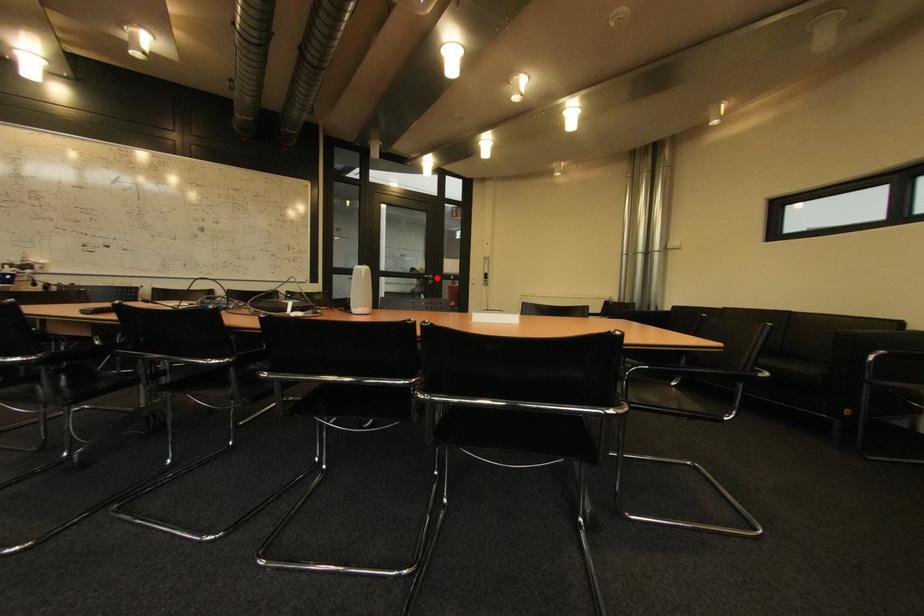
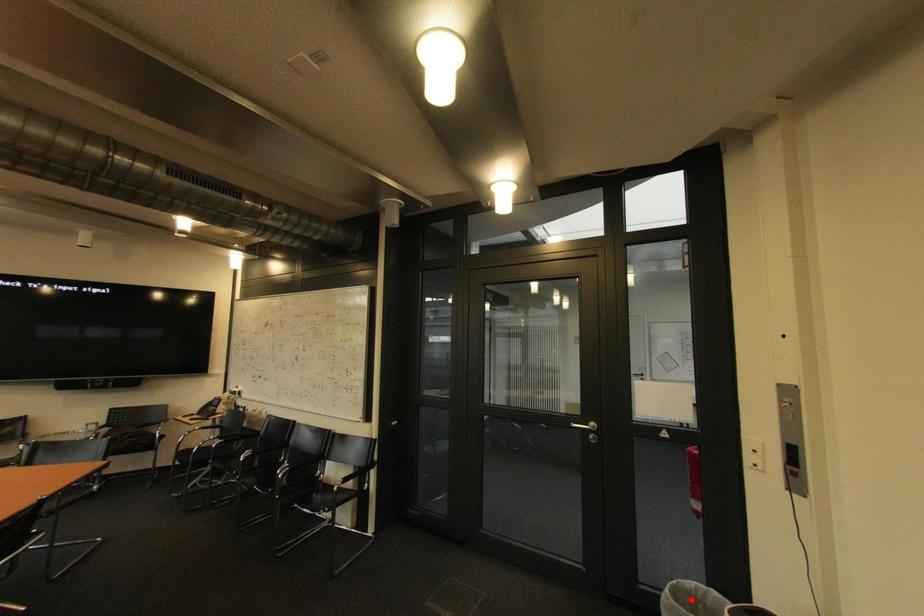
I am providing you with two images of the same scene from different viewpoints. A red point is marked on the first image and another point is marked on the second image. Is the marked point in image1 the same physical position as the marked point in image2?

No